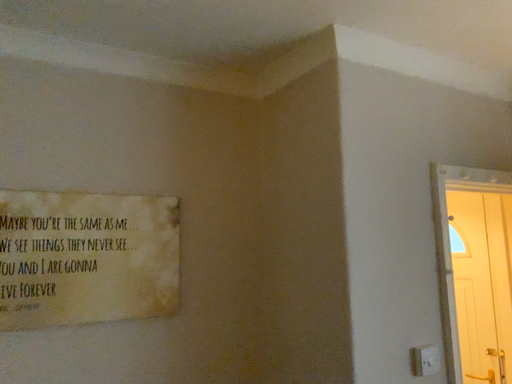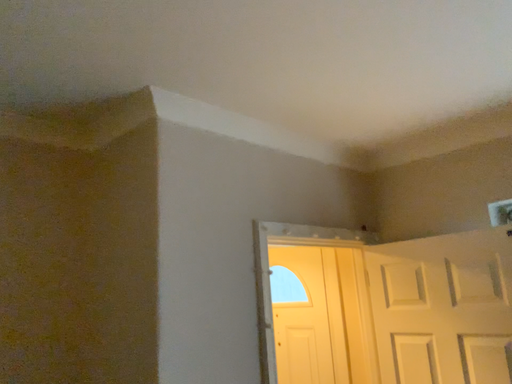
Question: How did the camera likely rotate when shooting the video?

Choices:
 (A) rotated downward
 (B) rotated upward

Answer: (B)